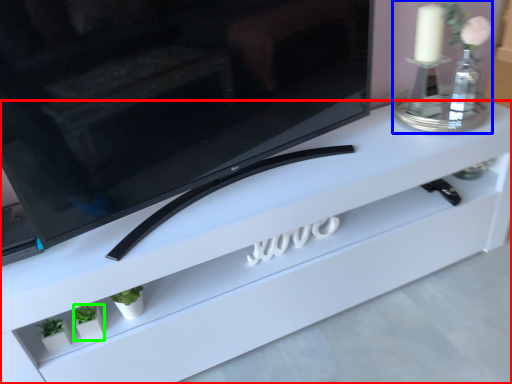
Question: Which is nearer to the furniture (highlighted by a red box)? candle holder (highlighted by a blue box) or plant (highlighted by a green box).

Choices:
 (A) candle holder
 (B) plant

Answer: (A)